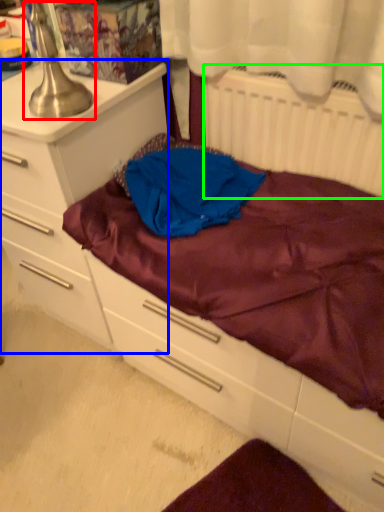
Question: Estimate the real-world distances between objects in this image. Which object is closer to table lamp (highlighted by a red box), chest of drawers (highlighted by a blue box) or radiator (highlighted by a green box)?

Choices:
 (A) chest of drawers
 (B) radiator

Answer: (A)